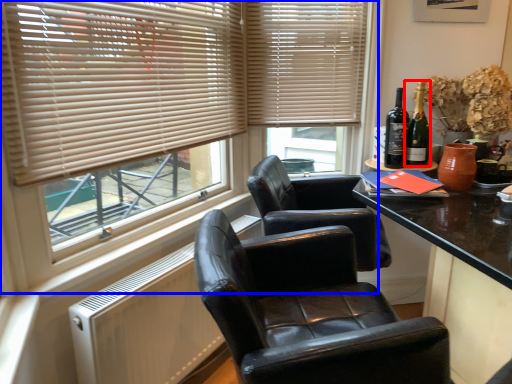
Question: Which point is further to the camera, bottle (highlighted by a red box) or window (highlighted by a blue box)?

Choices:
 (A) bottle
 (B) window

Answer: (A)